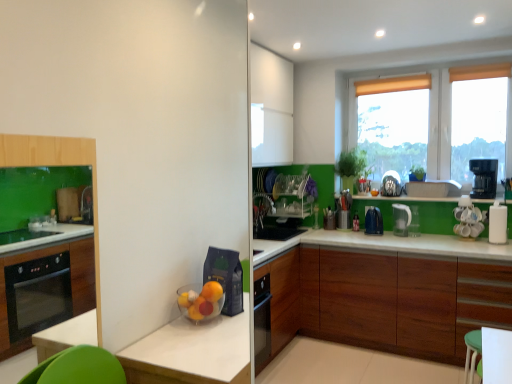
Image resolution: width=512 pixels, height=384 pixels. I want to click on metallic silver utensil holder at center-right, marked as the 4th appliance in a front-to-back arrangement, so click(x=344, y=210).

Locate an element on the screen. The height and width of the screenshot is (384, 512). black plastic coffee maker at upper right, arranged as the first kitchen appliance when viewed from the right is located at coordinates (484, 178).

The image size is (512, 384). What do you see at coordinates (391, 184) in the screenshot? I see `satin silver kettle at upper right, the third appliance from the right` at bounding box center [391, 184].

The image size is (512, 384). Describe the element at coordinates (497, 223) in the screenshot. I see `white glossy paper towel dispenser at right, marked as the 1th appliance in a right-to-left arrangement` at that location.

Describe the element at coordinates (440, 124) in the screenshot. I see `translucent plastic window at upper right` at that location.

How much space does white glossy coffee maker at right, arranged as the second appliance when viewed from the front, occupy horizontally?

It is 5.08 inches.

What do you see at coordinates (468, 219) in the screenshot? This screenshot has width=512, height=384. I see `white glossy coffee maker at right, the 2th appliance when ordered from right to left` at bounding box center [468, 219].

Image resolution: width=512 pixels, height=384 pixels. I want to click on metallic silver utensil holder at center-right, the fourth appliance positioned from the right, so click(x=344, y=210).

Is white glossy paper towel dispenser at right, the 1th appliance viewed from the front, completely or partially outside of white glossy table at lower right?

Indeed, white glossy paper towel dispenser at right, the 1th appliance viewed from the front, is completely outside white glossy table at lower right.

From the image's perspective, which one is positioned higher, white glossy paper towel dispenser at right, the 1th appliance viewed from the front, or white glossy table at lower right?

white glossy paper towel dispenser at right, the 1th appliance viewed from the front.

From a real-world perspective, between white glossy paper towel dispenser at right, the 1th appliance viewed from the front, and white glossy table at lower right, who is vertically lower?

white glossy table at lower right, from a real-world perspective.

Looking at the image, does white glossy paper towel dispenser at right, the 1th appliance viewed from the front, seem bigger or smaller compared to white glossy table at lower right?

white glossy paper towel dispenser at right, the 1th appliance viewed from the front, is smaller than white glossy table at lower right.

Considering the sizes of objects metallic silver utensil holder at center-right, the fourth appliance positioned from the right, and white glossy table at lower right in the image provided, who is bigger, metallic silver utensil holder at center-right, the fourth appliance positioned from the right, or white glossy table at lower right?

white glossy table at lower right.

Is point (350, 212) positioned behind point (487, 336)?

Yes, point (350, 212) is behind point (487, 336).

Which object is thinner, metallic silver utensil holder at center-right, marked as the 4th appliance in a front-to-back arrangement, or white glossy table at lower right?

metallic silver utensil holder at center-right, marked as the 4th appliance in a front-to-back arrangement, is thinner.

Is white glossy table at lower right completely or partially inside metallic silver utensil holder at center-right, the first appliance viewed from the left?

No, white glossy table at lower right is located outside of metallic silver utensil holder at center-right, the first appliance viewed from the left.

How much distance is there between metallic silver utensil holder at center-right, marked as the 4th appliance in a front-to-back arrangement, and white glossy coffee maker at right, the 3th appliance positioned from the left?

The distance of metallic silver utensil holder at center-right, marked as the 4th appliance in a front-to-back arrangement, from white glossy coffee maker at right, the 3th appliance positioned from the left, is 37.32 inches.

Is point (347, 209) closer or farther from the camera than point (471, 221)?

Point (347, 209) is farther from the camera than point (471, 221).

Identify the location of the 1st appliance below when counting from the metallic silver utensil holder at center-right, acting as the first appliance starting from the back (from the image's perspective). Image resolution: width=512 pixels, height=384 pixels. (468, 219).

Between clear plastic pitcher at upper right, the second kitchen appliance when ordered from right to left, and white glossy paper towel dispenser at right, marked as the 1th appliance in a right-to-left arrangement, which one has less height?

With less height is clear plastic pitcher at upper right, the second kitchen appliance when ordered from right to left.

From the image's perspective, is clear plastic pitcher at upper right, which is the 2th kitchen appliance from left to right, above or below white glossy paper towel dispenser at right, marked as the 1th appliance in a right-to-left arrangement?

Based on their image positions, clear plastic pitcher at upper right, which is the 2th kitchen appliance from left to right, is located beneath white glossy paper towel dispenser at right, marked as the 1th appliance in a right-to-left arrangement.

Between clear plastic pitcher at upper right, the second kitchen appliance when ordered from right to left, and white glossy paper towel dispenser at right, the fourth appliance viewed from the back, which one appears on the left side from the viewer's perspective?

clear plastic pitcher at upper right, the second kitchen appliance when ordered from right to left.

Looking at this image, does blue plastic kettle at center, the 1th kitchen appliance in the left-to-right sequence, appear on the right side of wooden cabinet at lower right?

In fact, blue plastic kettle at center, the 1th kitchen appliance in the left-to-right sequence, is to the left of wooden cabinet at lower right.

In the scene shown: Is blue plastic kettle at center, the 1th kitchen appliance in the left-to-right sequence, next to wooden cabinet at lower right and touching it?

No, blue plastic kettle at center, the 1th kitchen appliance in the left-to-right sequence, is not beside wooden cabinet at lower right.

Is blue plastic kettle at center, the 3th kitchen appliance from the right, looking in the opposite direction of wooden cabinet at lower right?

No, wooden cabinet at lower right is not at the back of blue plastic kettle at center, the 3th kitchen appliance from the right.

Is metallic silver utensil holder at center-right, the first appliance viewed from the left, not near blue plastic kettle at center, the 3th kitchen appliance from the right?

That's not correct — metallic silver utensil holder at center-right, the first appliance viewed from the left, is a little close to blue plastic kettle at center, the 3th kitchen appliance from the right.

Looking at this image, how far apart are metallic silver utensil holder at center-right, acting as the first appliance starting from the back, and blue plastic kettle at center, the 3th kitchen appliance from the right?

A distance of 8.62 inches exists between metallic silver utensil holder at center-right, acting as the first appliance starting from the back, and blue plastic kettle at center, the 3th kitchen appliance from the right.

From the image's perspective, is metallic silver utensil holder at center-right, acting as the first appliance starting from the back, located above or below blue plastic kettle at center, the 1th kitchen appliance in the left-to-right sequence?

Clearly, from the image's perspective, metallic silver utensil holder at center-right, acting as the first appliance starting from the back, is above blue plastic kettle at center, the 1th kitchen appliance in the left-to-right sequence.

Where is `appliance that is the 3rd object located above the blue plastic kettle at center, the 3th kitchen appliance from the right (from the image's perspective)`? This screenshot has width=512, height=384. appliance that is the 3rd object located above the blue plastic kettle at center, the 3th kitchen appliance from the right (from the image's perspective) is located at coordinates (344, 210).

How different are the orientations of satin silver kettle at upper right, which is the second appliance from back to front, and white glossy coffee maker at right, the 3th appliance positioned from the left, in degrees?

There is a 2.55-degree angle between the facing directions of satin silver kettle at upper right, which is the second appliance from back to front, and white glossy coffee maker at right, the 3th appliance positioned from the left.

Based on the photo, are satin silver kettle at upper right, positioned as the 2th appliance in left-to-right order, and white glossy coffee maker at right, the 3th appliance positioned from the left, making contact?

No, satin silver kettle at upper right, positioned as the 2th appliance in left-to-right order, is not with white glossy coffee maker at right, the 3th appliance positioned from the left.

From a real-world perspective, is satin silver kettle at upper right, the third appliance viewed from the front, located higher than white glossy coffee maker at right, the 3th appliance positioned from the left?

Indeed, from a real-world perspective, satin silver kettle at upper right, the third appliance viewed from the front, stands above white glossy coffee maker at right, the 3th appliance positioned from the left.

Which object is closer to the camera taking this photo, satin silver kettle at upper right, which is the second appliance from back to front, or white glossy coffee maker at right, arranged as the second appliance when viewed from the front?

white glossy coffee maker at right, arranged as the second appliance when viewed from the front, is more forward.

This screenshot has height=384, width=512. I want to click on the 2nd appliance above the white glossy table at lower right (from a real-world perspective), so click(497, 223).

Where is `table in front of the metallic silver utensil holder at center-right, marked as the 4th appliance in a front-to-back arrangement`? This screenshot has width=512, height=384. table in front of the metallic silver utensil holder at center-right, marked as the 4th appliance in a front-to-back arrangement is located at coordinates (496, 355).

Based on their spatial positions, is wooden cabinet at lower right or white glossy paper towel dispenser at right, marked as the 1th appliance in a right-to-left arrangement, closer to white glossy coffee maker at right, which appears as the third appliance when viewed from the back?

Result: white glossy paper towel dispenser at right, marked as the 1th appliance in a right-to-left arrangement, is closer to white glossy coffee maker at right, which appears as the third appliance when viewed from the back.

From the image, which object appears to be nearer to black plastic coffee maker at upper right, arranged as the first kitchen appliance when viewed from the right, wooden cabinet at lower right or white glossy coffee maker at right, the 2th appliance when ordered from right to left?

white glossy coffee maker at right, the 2th appliance when ordered from right to left.

Which object lies further to the anchor point white glossy coffee maker at right, which appears as the third appliance when viewed from the back, clear plastic pitcher at upper right, which is the 2th kitchen appliance from left to right, or white glossy table at lower right?

The object further to white glossy coffee maker at right, which appears as the third appliance when viewed from the back, is white glossy table at lower right.

From the image, which object appears to be farther from white glossy coffee maker at right, the 2th appliance when ordered from right to left, white glossy paper towel dispenser at right, the fourth appliance viewed from the back, or blue plastic kettle at center, the 3th kitchen appliance from the right?

blue plastic kettle at center, the 3th kitchen appliance from the right, is positioned further to the anchor white glossy coffee maker at right, the 2th appliance when ordered from right to left.

Based on the photo, estimate the real-world distances between objects in this image. Which object is closer to white glossy coffee maker at right, the 2th appliance when ordered from right to left, wooden cabinet at lower right or blue plastic kettle at center, the 1th kitchen appliance in the left-to-right sequence?

blue plastic kettle at center, the 1th kitchen appliance in the left-to-right sequence.

From the image, which object appears to be nearer to satin silver kettle at upper right, the third appliance from the right, blue plastic kettle at center, the 1th kitchen appliance in the left-to-right sequence, or white glossy coffee maker at right, arranged as the second appliance when viewed from the front?

blue plastic kettle at center, the 1th kitchen appliance in the left-to-right sequence, is positioned closer to the anchor satin silver kettle at upper right, the third appliance from the right.

When comparing their distances from blue plastic kettle at center, the 3th kitchen appliance from the right, does white glossy table at lower right or satin silver kettle at upper right, positioned as the 2th appliance in left-to-right order, seem closer?

Among the two, satin silver kettle at upper right, positioned as the 2th appliance in left-to-right order, is located nearer to blue plastic kettle at center, the 3th kitchen appliance from the right.

Which object lies nearer to the anchor point translucent plastic window at upper right, white glossy coffee maker at right, the 2th appliance when ordered from right to left, or black plastic coffee maker at upper right, arranged as the first kitchen appliance when viewed from the right?

black plastic coffee maker at upper right, arranged as the first kitchen appliance when viewed from the right, is closer to translucent plastic window at upper right.

Image resolution: width=512 pixels, height=384 pixels. Identify the location of kitchen appliance between blue plastic kettle at center, the 1th kitchen appliance in the left-to-right sequence, and black plastic coffee maker at upper right, the third kitchen appliance from the left, from left to right. (401, 219).

Image resolution: width=512 pixels, height=384 pixels. What are the coordinates of `kitchen appliance between blue plastic kettle at center, the 1th kitchen appliance in the left-to-right sequence, and white glossy paper towel dispenser at right, marked as the 1th appliance in a right-to-left arrangement, in the horizontal direction` in the screenshot? It's located at (401, 219).

Where is `kitchen appliance between metallic silver utensil holder at center-right, the fourth appliance positioned from the right, and satin silver kettle at upper right, the third appliance viewed from the front, in the horizontal direction`? kitchen appliance between metallic silver utensil holder at center-right, the fourth appliance positioned from the right, and satin silver kettle at upper right, the third appliance viewed from the front, in the horizontal direction is located at coordinates (373, 221).

Identify the location of window between metallic silver utensil holder at center-right, the fourth appliance positioned from the right, and white glossy coffee maker at right, the 2th appliance when ordered from right to left. The width and height of the screenshot is (512, 384). (440, 124).